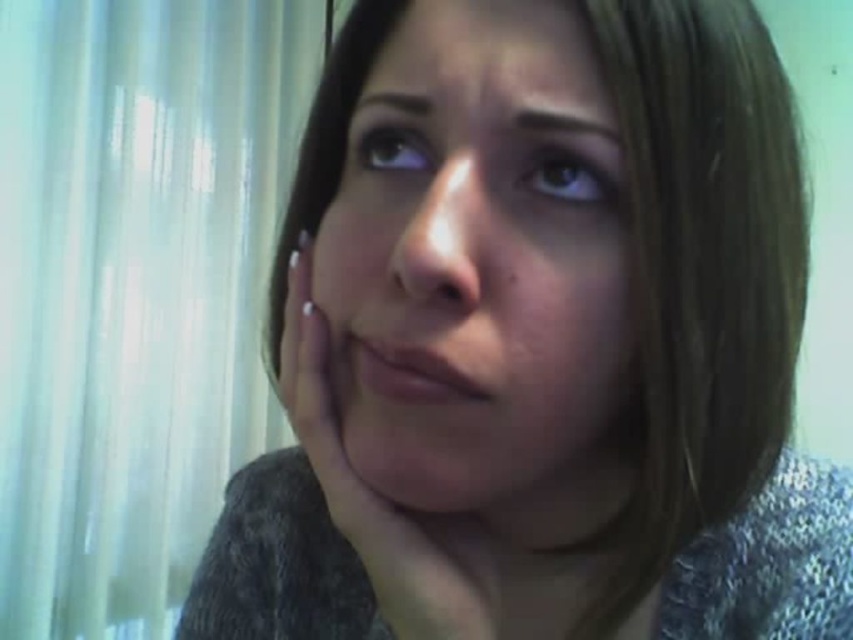
You are a photographer adjusting the lighting for a portrait. You notice the smooth skin face at center and the nail polish at center in your frame. Which object should you focus on first if you want to ensure proper exposure for the closer subject?

The smooth skin face at center is located above the nail polish at center, so the nail polish at center is further away. Therefore, you should focus on the smooth skin face at center first to ensure proper exposure for the closer subject.

You are a photographer adjusting lighting for a portrait. The subject has a smooth skin face at center and nail polish at center. To ensure both are well lit, which object should you focus the light on first considering their sizes?

The smooth skin face at center has a larger width than the nail polish at center, so you should focus the light on the smooth skin face at center first to ensure proper exposure and detail capture.